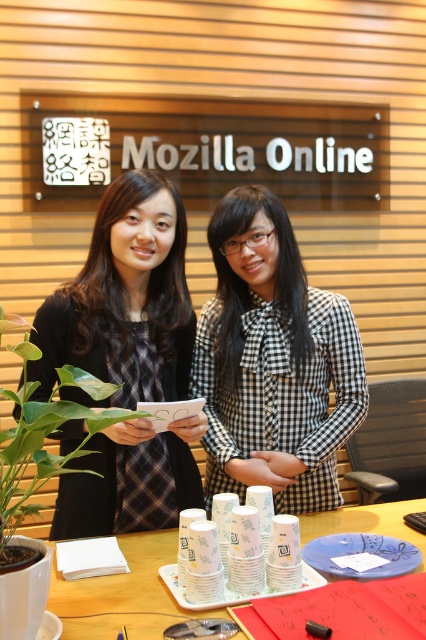
Which of these two, matte black dress at center or black checkered blouse at center, stands shorter?

Standing shorter between the two is black checkered blouse at center.

Can you confirm if matte black dress at center is bigger than black checkered blouse at center?

Correct, matte black dress at center is larger in size than black checkered blouse at center.

Is point (141, 474) behind point (221, 216)?

No, (141, 474) is in front of (221, 216).

Where is `matte black dress at center`? This screenshot has height=640, width=426. matte black dress at center is located at coordinates (124, 300).

Which of these two, black checkered blouse at center or green leafy plant at left, stands shorter?

Standing shorter between the two is green leafy plant at left.

Does black checkered blouse at center appear on the left side of green leafy plant at left?

No, black checkered blouse at center is not to the left of green leafy plant at left.

Is point (270, 330) behind point (31, 504)?

Yes.

Identify the location of black checkered blouse at center. (273, 362).

What do you see at coordinates (121, 593) in the screenshot?
I see `white paper cups at center` at bounding box center [121, 593].

Who is more forward, (x=72, y=588) or (x=86, y=406)?

Point (x=86, y=406)

Where is `white paper cups at center`? The width and height of the screenshot is (426, 640). white paper cups at center is located at coordinates (121, 593).